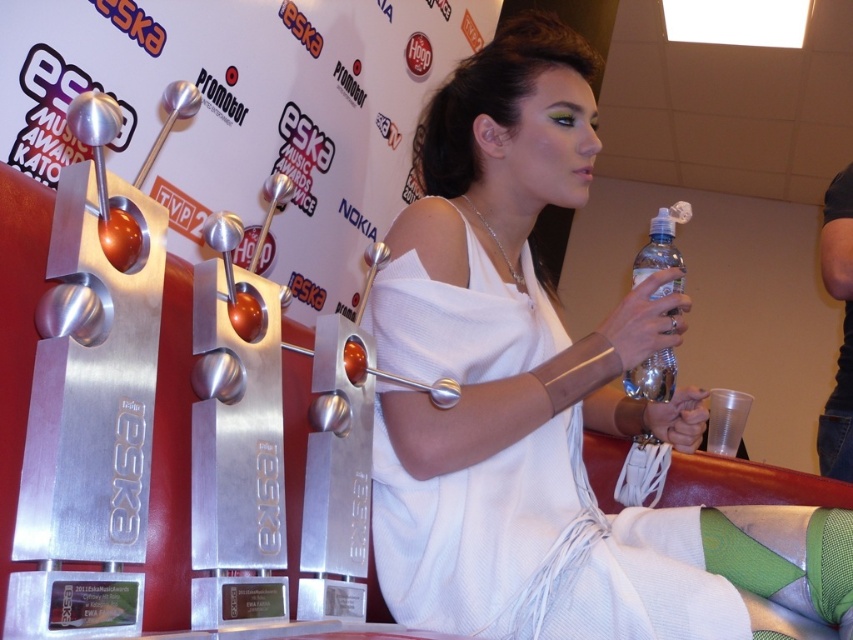
You are a photographer at the eska Music Awards. You need to capture a closeup shot of the clear plastic bottle at center without the white fabric dress at center blocking the view. Is this possible given their sizes?

The white fabric dress at center has a larger size compared to clear plastic bottle at center. Since the dress is larger, it might block the view of the bottle unless positioned carefully. Adjust the angle to ensure the bottle is framed away from the dress.

You are a photographer at the eska Music Awards. You need to capture a photo of the white fabric dress at center and the clear plastic bottle at center. Which object is closer to the camera?

The white fabric dress at center is positioned under the clear plastic bottle at center, so the clear plastic bottle at center is closer to the camera.

You are a photographer at the eska Music Awards. You need to capture a shot of the white fabric dress at center and the clear plastic bottle at center. Which object is positioned to the left of the other?

The white fabric dress at center is to the left of the clear plastic bottle at center.